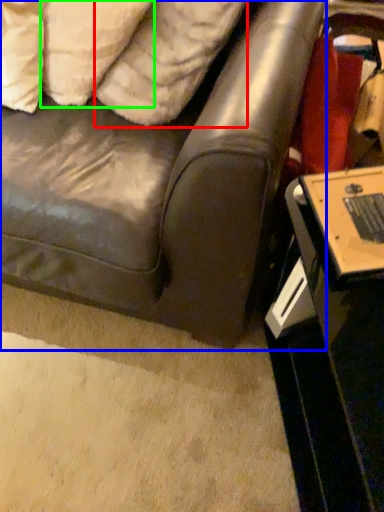
Question: Which is farther away from pillow (highlighted by a red box)? studio couch (highlighted by a blue box) or pillow (highlighted by a green box)?

Choices:
 (A) studio couch
 (B) pillow

Answer: (A)